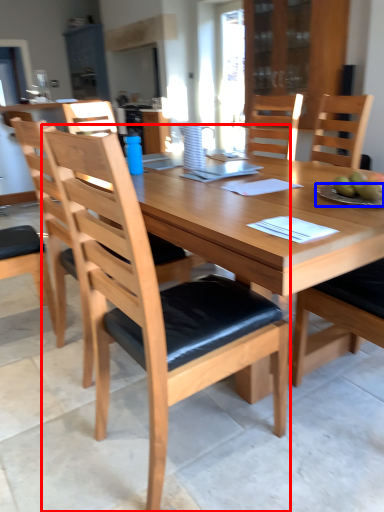
Question: Which point is closer to the camera, chair (highlighted by a red box) or plate (highlighted by a blue box)?

Choices:
 (A) chair
 (B) plate

Answer: (A)